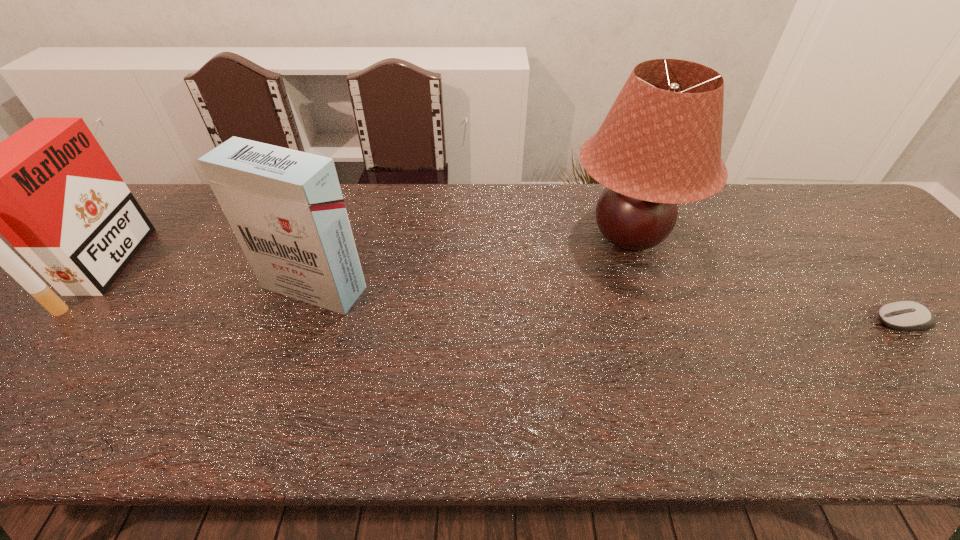
What are the coordinates of `vacant space located 0.260m on the front-facing side of the leftmost object` in the screenshot? It's located at [227, 268].

Locate an element on the screen. This screenshot has width=960, height=540. free space located 0.050m on the wheel side of the computer equipment is located at coordinates (855, 322).

Locate an element on the screen. free space located on the wheel side of the computer equipment is located at coordinates (764, 322).

At what (x,y) coordinates should I click in order to perform the action: click on free spot located 0.130m on the wheel side of the computer equipment. Please return your answer as a coordinate pair (x, y). Looking at the image, I should click on (821, 322).

This screenshot has width=960, height=540. In order to click on lampshade at the far edge in this screenshot , I will do `click(660, 144)`.

Locate an element on the screen. The image size is (960, 540). cigarette case that is at the far edge is located at coordinates (49, 189).

In order to click on object positioned at the left edge in this screenshot , I will do `click(49, 189)`.

Find the location of a particular element. Image resolution: width=960 pixels, height=540 pixels. object located at the right edge is located at coordinates (903, 315).

Where is `object at the far left corner`? This screenshot has width=960, height=540. object at the far left corner is located at coordinates (49, 189).

I want to click on free space at the far edge of the desktop, so click(731, 200).